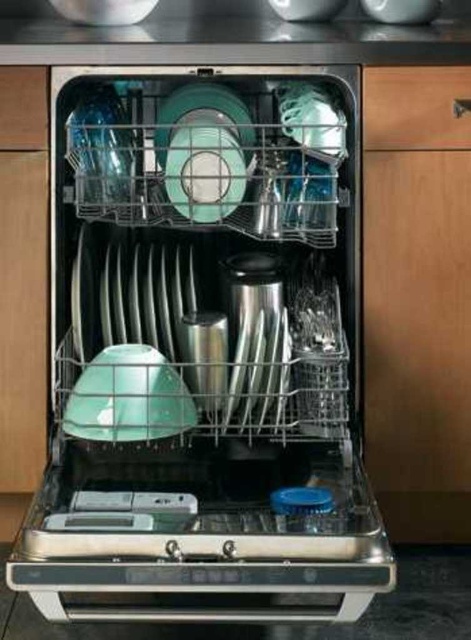
Question: Which point is farther to the camera?

Choices:
 (A) (15, 148)
 (B) (191, 324)
 (C) (454, 74)

Answer: (B)

Question: From the image, what is the correct spatial relationship of stainless steel dishwasher at center in relation to wooden drawer at right?

Choices:
 (A) left
 (B) right

Answer: (A)

Question: Which point appears closest to the camera in this image?

Choices:
 (A) (1, 116)
 (B) (366, 68)

Answer: (B)

Question: Which of these objects is positioned farthest from the wooden drawer at left?

Choices:
 (A) wooden drawer at right
 (B) stainless steel dishwasher at center

Answer: (A)

Question: Can you confirm if stainless steel dishwasher at center is bigger than wooden drawer at left?

Choices:
 (A) yes
 (B) no

Answer: (A)

Question: Is wooden drawer at right positioned at the back of wooden drawer at left?

Choices:
 (A) no
 (B) yes

Answer: (B)